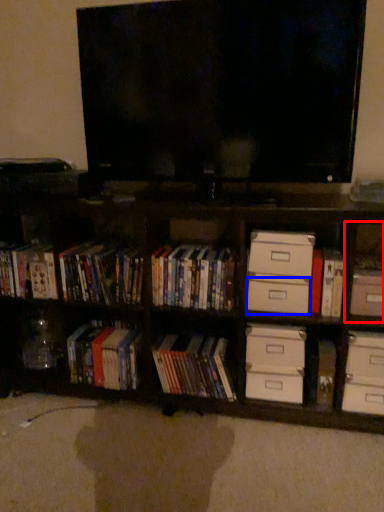
Question: Which point is closer to the camera, cabinet (highlighted by a red box) or drawer (highlighted by a blue box)?

Choices:
 (A) cabinet
 (B) drawer

Answer: (A)